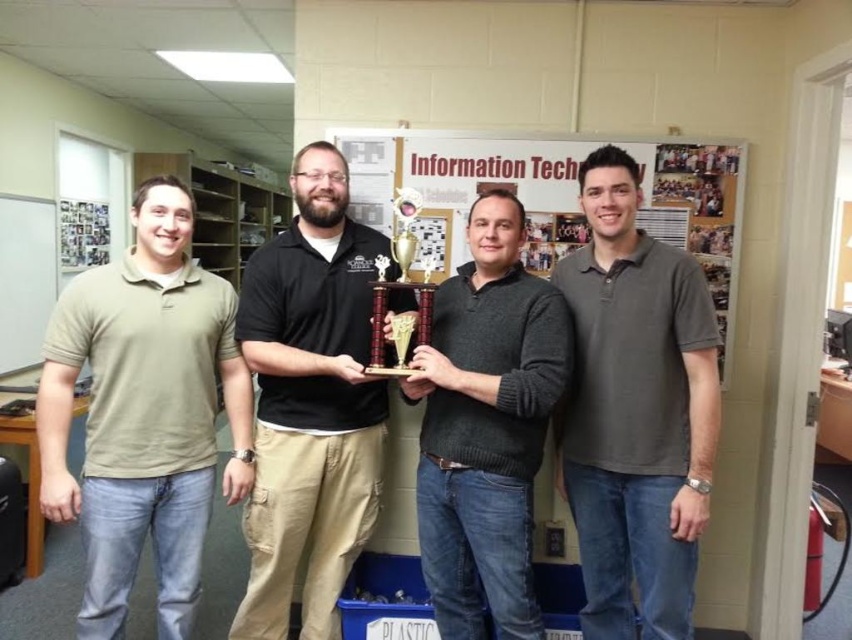
Question: Is olive green polo shirt at left to the right of wooden plaque at center from the viewer's perspective?

Choices:
 (A) yes
 (B) no

Answer: (B)

Question: Is black matte shirt at center behind dark gray sweater at center?

Choices:
 (A) yes
 (B) no

Answer: (A)

Question: Which point is farther from the camera taking this photo?

Choices:
 (A) (378, 282)
 (B) (309, 330)
 (C) (514, 272)
 (D) (709, 456)

Answer: (B)

Question: Which point appears farthest from the camera in this image?

Choices:
 (A) (239, 630)
 (B) (607, 365)

Answer: (A)

Question: Is olive green polo shirt at left to the left of dark gray sweater at center from the viewer's perspective?

Choices:
 (A) no
 (B) yes

Answer: (B)

Question: Which object is positioned farthest from the dark gray sweater at center?

Choices:
 (A) black matte shirt at center
 (B) dark gray polo shirt at right
 (C) olive green polo shirt at left
 (D) wooden plaque at center

Answer: (D)